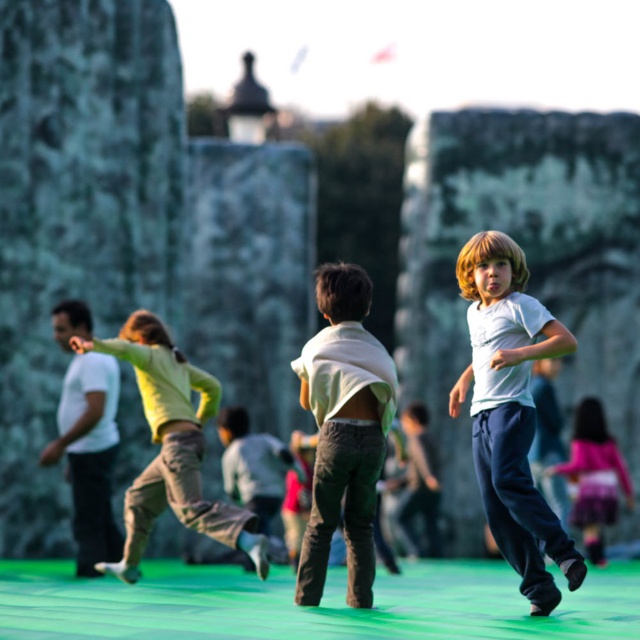
Question: Which point is closer to the camera taking this photo?

Choices:
 (A) (218, 406)
 (B) (112, 388)
 (C) (387, 376)

Answer: (C)

Question: Is white matte shirt at center smaller than pink satin dress at lower right?

Choices:
 (A) no
 (B) yes

Answer: (A)

Question: Which point is closer to the camera taking this photo?

Choices:
 (A) (93, 474)
 (B) (512, 403)

Answer: (B)

Question: Is white matte shirt at center below pink satin dress at lower right?

Choices:
 (A) no
 (B) yes

Answer: (A)

Question: Which object is closer to the camera taking this photo?

Choices:
 (A) pink satin dress at lower right
 (B) white matte shirt at center
 (C) white matte shirt at left

Answer: (B)

Question: Does white matte shirt at center appear on the left side of matte white shirt at center?

Choices:
 (A) yes
 (B) no

Answer: (B)